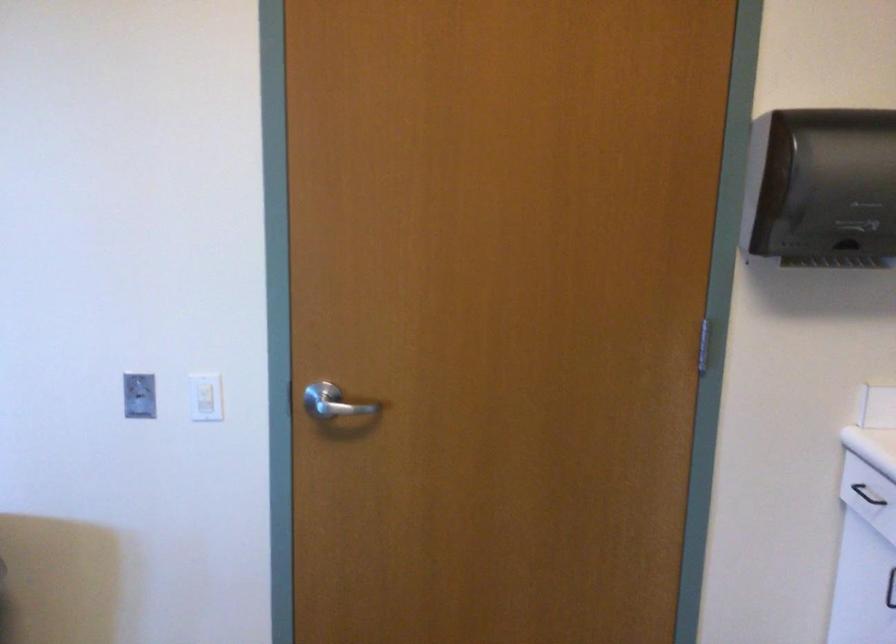
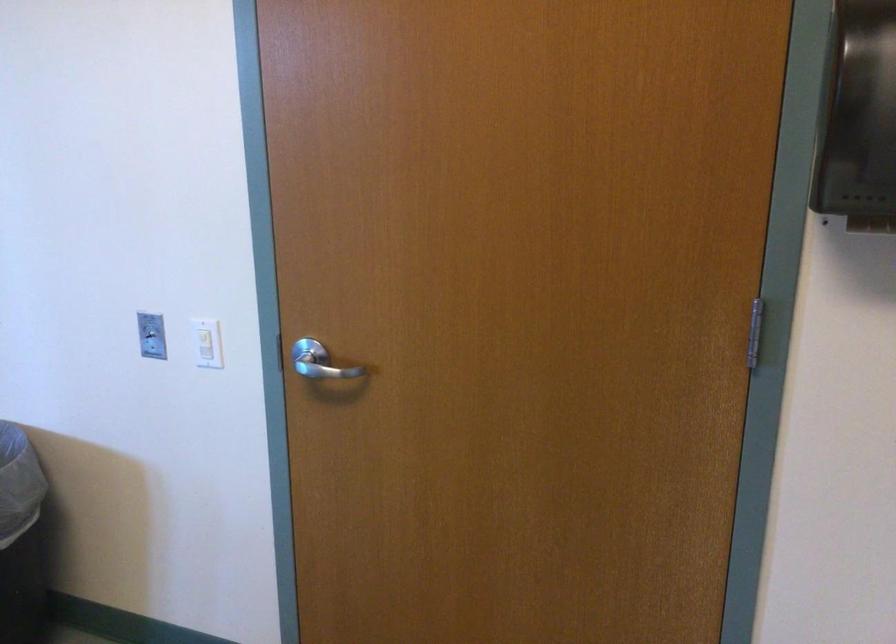
Question: How did the camera likely rotate?

Choices:
 (A) Left
 (B) Right
 (C) Up
 (D) Down

Answer: (A)